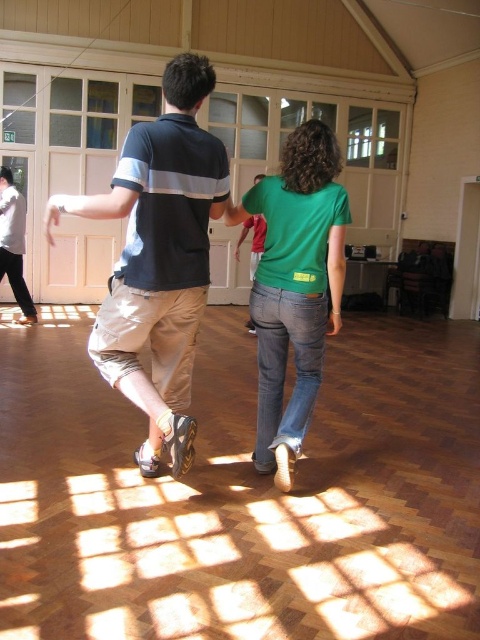
Which is above, matte black polo shirt at center or green cotton shirt at center?

matte black polo shirt at center is higher up.

Who is more forward, (135, 218) or (307, 177)?

Point (135, 218) is in front.

Who is more distant from viewer, [151,332] or [292,424]?

Point [292,424]

This screenshot has width=480, height=640. I want to click on matte black polo shirt at center, so click(158, 259).